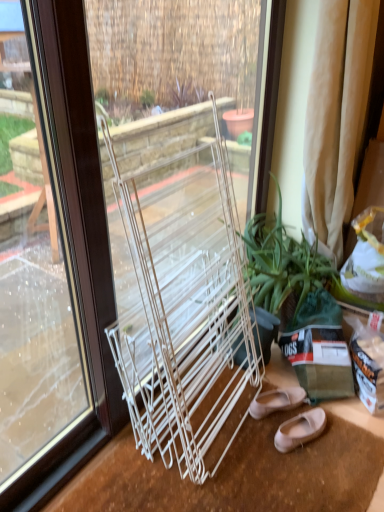
Question: Does green leafy plant at center have a larger size compared to matte beige flats at lower right, marked as the second footwear in a front-to-back arrangement?

Choices:
 (A) no
 (B) yes

Answer: (B)

Question: Does green leafy plant at center have a greater height compared to matte beige flats at lower right, marked as the second footwear in a front-to-back arrangement?

Choices:
 (A) no
 (B) yes

Answer: (B)

Question: Can you see green leafy plant at center touching matte beige flats at lower right, marked as the second footwear in a front-to-back arrangement?

Choices:
 (A) no
 (B) yes

Answer: (A)

Question: From a real-world perspective, is green leafy plant at center located higher than matte beige flats at lower right, arranged as the first footwear when viewed from the back?

Choices:
 (A) yes
 (B) no

Answer: (A)

Question: Is green leafy plant at center thinner than matte beige flats at lower right, arranged as the first footwear when viewed from the back?

Choices:
 (A) no
 (B) yes

Answer: (A)

Question: Considering the positions of matte beige flats at lower right, marked as the second footwear in a front-to-back arrangement, and clear glass window at center in the image, is matte beige flats at lower right, marked as the second footwear in a front-to-back arrangement, bigger or smaller than clear glass window at center?

Choices:
 (A) big
 (B) small

Answer: (B)

Question: Is matte beige flats at lower right, arranged as the first footwear when viewed from the back, inside or outside of clear glass window at center?

Choices:
 (A) outside
 (B) inside

Answer: (A)

Question: Considering the positions of point (296, 389) and point (258, 99), is point (296, 389) closer or farther from the camera than point (258, 99)?

Choices:
 (A) farther
 (B) closer

Answer: (B)

Question: Is matte beige flats at lower right, arranged as the first footwear when viewed from the back, taller or shorter than clear glass window at center?

Choices:
 (A) short
 (B) tall

Answer: (A)

Question: Considering their positions, is green leafy plant at center located in front of or behind clear glass window at center?

Choices:
 (A) behind
 (B) front

Answer: (A)

Question: Does point (258, 290) appear closer or farther from the camera than point (87, 194)?

Choices:
 (A) farther
 (B) closer

Answer: (A)

Question: Do you think green leafy plant at center is within clear glass window at center, or outside of it?

Choices:
 (A) outside
 (B) inside

Answer: (B)

Question: Is green leafy plant at center bigger or smaller than clear glass window at center?

Choices:
 (A) big
 (B) small

Answer: (B)

Question: In terms of width, does green leafy plant at center look wider or thinner when compared to beige fabric curtain at right?

Choices:
 (A) thin
 (B) wide

Answer: (B)

Question: From a real-world perspective, is green leafy plant at center above or below beige fabric curtain at right?

Choices:
 (A) above
 (B) below

Answer: (B)